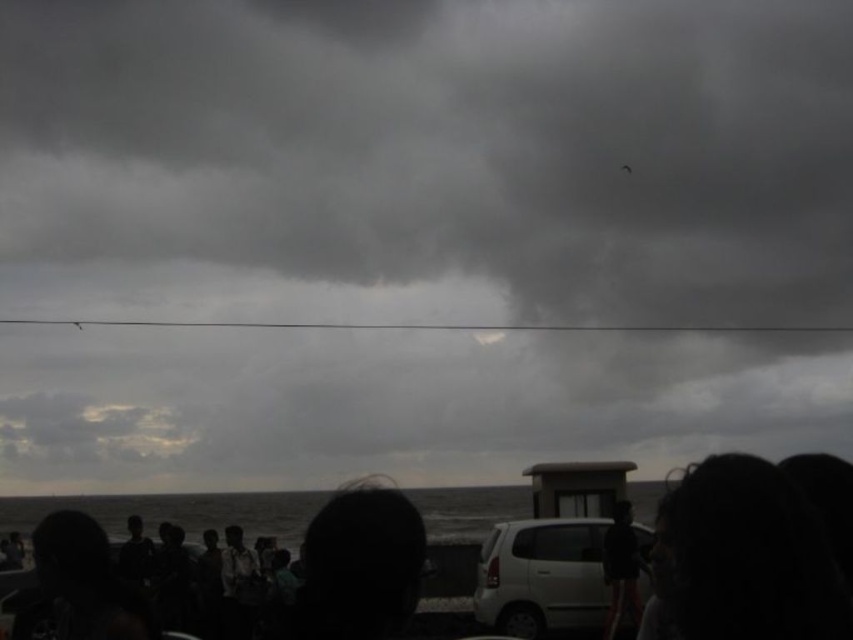
Question: Among these objects, which one is farthest from the camera?

Choices:
 (A) dark fabric person at lower right
 (B) white matte car at center

Answer: (B)

Question: Which object is the closest to the dark fabric person at lower right?

Choices:
 (A) black matte crowd at lower center
 (B) white matte car at center
 (C) dark hair at lower right

Answer: (B)

Question: Does dark hair at lower right appear under white matte car at center?

Choices:
 (A) yes
 (B) no

Answer: (B)

Question: Observing the image, what is the correct spatial positioning of dark hair at lower right in reference to dark fabric person at lower right?

Choices:
 (A) right
 (B) left

Answer: (B)

Question: Which object is farther from the camera taking this photo?

Choices:
 (A) black matte crowd at lower center
 (B) dark hair at lower right

Answer: (A)

Question: Can you confirm if dark hair at lower right is wider than white matte car at center?

Choices:
 (A) no
 (B) yes

Answer: (A)